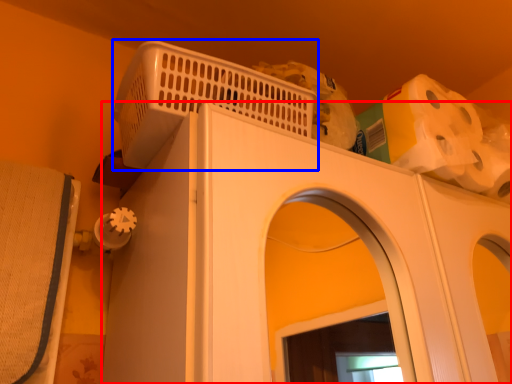
Question: Which object appears closest to the camera in this image, home appliance (highlighted by a red box) or basket (highlighted by a blue box)?

Choices:
 (A) home appliance
 (B) basket

Answer: (A)